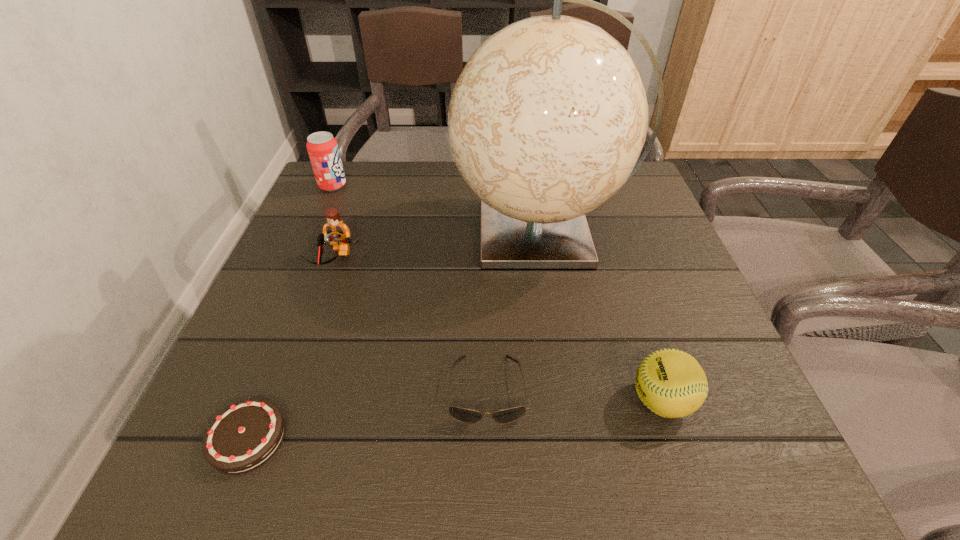
This screenshot has height=540, width=960. Identify the location of chocolate cake present at the near edge. (247, 434).

You are a GUI agent. You are given a task and a screenshot of the screen. Output one action in this format:
    pyautogui.click(x=<x>, y=<y>)
    Task: Click on the soda can that is at the left edge
    Image resolution: width=960 pixels, height=540 pixels.
    Given the screenshot: What is the action you would take?
    pyautogui.click(x=322, y=147)

I want to click on Lego that is positioned at the left edge, so click(x=336, y=233).

What are the coordinates of `chocolate cake that is at the left edge` in the screenshot? It's located at (247, 434).

You are a GUI agent. You are given a task and a screenshot of the screen. Output one action in this format:
    pyautogui.click(x=<x>, y=<y>)
    Task: Click on the globe that is at the right edge
    Image resolution: width=960 pixels, height=540 pixels.
    Given the screenshot: What is the action you would take?
    tap(546, 122)

Locate an element on the screen. softball that is at the right edge is located at coordinates (671, 383).

The height and width of the screenshot is (540, 960). In order to click on object that is at the far left corner in this screenshot , I will do `click(322, 147)`.

I want to click on object present at the near left corner, so click(x=247, y=434).

You are a GUI agent. You are given a task and a screenshot of the screen. Output one action in this format:
    pyautogui.click(x=<x>, y=<y>)
    Task: Click on the object that is at the far right corner
    
    Given the screenshot: What is the action you would take?
    pyautogui.click(x=546, y=122)

This screenshot has height=540, width=960. Identify the location of object at the near right corner. (671, 383).